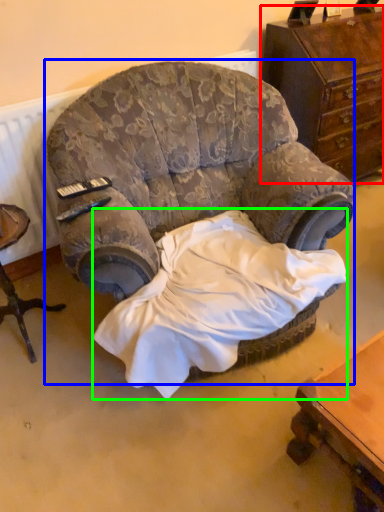
Question: Which object is positioned closest to chest of drawers (highlighted by a red box)? Select from chair (highlighted by a blue box) and sheet (highlighted by a green box).

Choices:
 (A) chair
 (B) sheet

Answer: (A)